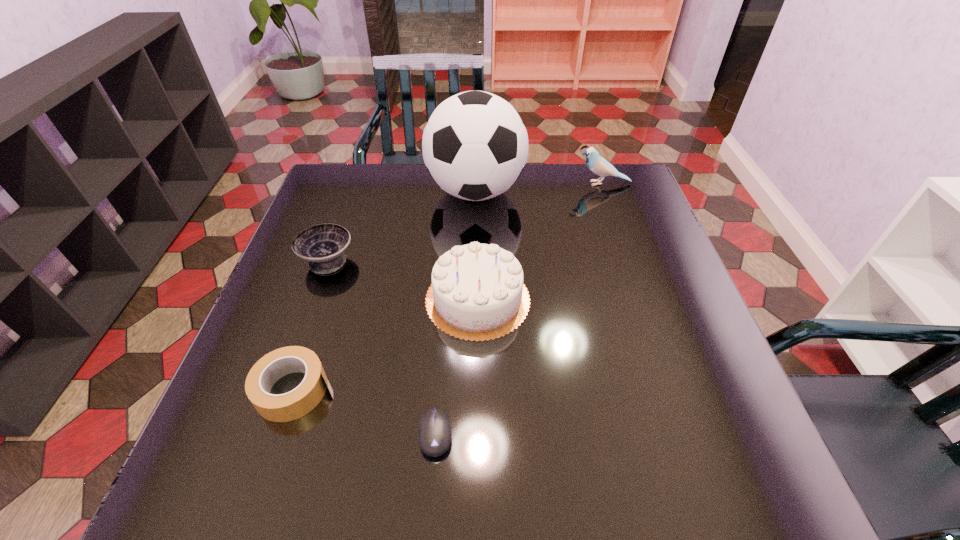
Identify the location of object at the far right corner. The width and height of the screenshot is (960, 540). (598, 165).

The image size is (960, 540). What are the coordinates of `vacant space at the far edge of the desktop` in the screenshot? It's located at (400, 207).

Image resolution: width=960 pixels, height=540 pixels. Find the location of `vacant region at the near edge`. vacant region at the near edge is located at coordinates (303, 472).

The width and height of the screenshot is (960, 540). Identify the location of free region at the left edge of the desktop. (288, 280).

This screenshot has width=960, height=540. I want to click on vacant area at the right edge, so click(604, 244).

Find the location of a particular element. vacant space at the far left corner of the desktop is located at coordinates (332, 203).

Identify the location of vacant space at the far right corner of the desktop. (617, 201).

Locate an element on the screen. This screenshot has width=960, height=540. vacant space at the near right corner of the desktop is located at coordinates (754, 475).

The image size is (960, 540). I want to click on free spot between the birthday cake and the third shortest object, so click(402, 280).

You are a GUI agent. You are given a task and a screenshot of the screen. Output one action in this format:
    pyautogui.click(x=<x>, y=<y>)
    Task: Click on the vacant area that lies between the bowl and the tallest object
    
    Given the screenshot: What is the action you would take?
    pyautogui.click(x=401, y=226)